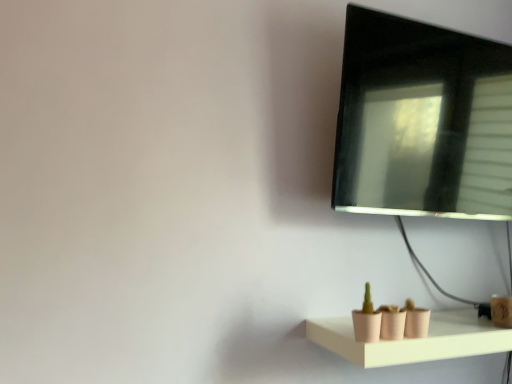
Question: In the image, is black glossy monitor at upper right positioned in front of or behind matte pink shelf at lower right?

Choices:
 (A) behind
 (B) front

Answer: (A)

Question: Is black glossy monitor at upper right to the left or to the right of matte pink shelf at lower right in the image?

Choices:
 (A) right
 (B) left

Answer: (A)

Question: In terms of width, does black glossy monitor at upper right look wider or thinner when compared to matte pink shelf at lower right?

Choices:
 (A) wide
 (B) thin

Answer: (B)

Question: Considering the relative positions of matte pink shelf at lower right and black glossy monitor at upper right in the image provided, is matte pink shelf at lower right to the left or to the right of black glossy monitor at upper right?

Choices:
 (A) right
 (B) left

Answer: (B)

Question: From a real-world perspective, relative to black glossy monitor at upper right, is matte pink shelf at lower right vertically above or below?

Choices:
 (A) below
 (B) above

Answer: (A)

Question: Is matte pink shelf at lower right inside the boundaries of black glossy monitor at upper right, or outside?

Choices:
 (A) inside
 (B) outside

Answer: (B)

Question: From their relative heights in the image, would you say matte pink shelf at lower right is taller or shorter than black glossy monitor at upper right?

Choices:
 (A) short
 (B) tall

Answer: (A)